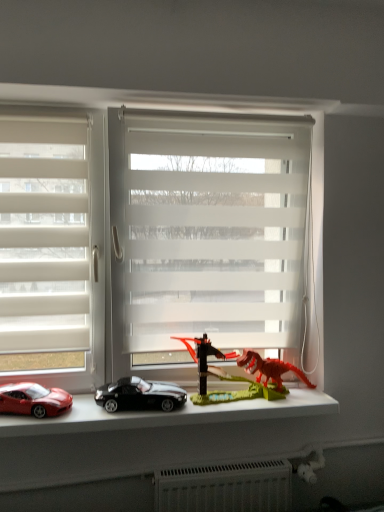
Question: Is white translucent blinds at left, which is counted as the 1th window, starting from the left, oriented towards shiny red car at lower left, which is the first car from left to right?

Choices:
 (A) no
 (B) yes

Answer: (A)

Question: From a real-world perspective, does white translucent blinds at left, which ranks as the second window in right-to-left order, stand above shiny red car at lower left, placed as the 2th car when sorted from right to left?

Choices:
 (A) no
 (B) yes

Answer: (B)

Question: Is the depth of white translucent blinds at left, which ranks as the second window in right-to-left order, less than that of shiny red car at lower left, placed as the 2th car when sorted from right to left?

Choices:
 (A) no
 (B) yes

Answer: (A)

Question: From the image's perspective, is white translucent blinds at left, which is counted as the 1th window, starting from the left, located beneath shiny red car at lower left, placed as the 2th car when sorted from right to left?

Choices:
 (A) yes
 (B) no

Answer: (B)

Question: Is white translucent blinds at left, which ranks as the second window in right-to-left order, to the left or to the right of rubberized red dinosaur at center in the image?

Choices:
 (A) right
 (B) left

Answer: (B)

Question: From a real-world perspective, is white translucent blinds at left, which is counted as the 1th window, starting from the left, positioned above or below rubberized red dinosaur at center?

Choices:
 (A) below
 (B) above

Answer: (B)

Question: Is white translucent blinds at left, which ranks as the second window in right-to-left order, bigger or smaller than rubberized red dinosaur at center?

Choices:
 (A) small
 (B) big

Answer: (A)

Question: Is point (6, 330) closer or farther from the camera than point (200, 371)?

Choices:
 (A) farther
 (B) closer

Answer: (B)

Question: Is rubberized red dinosaur at center inside or outside of white translucent blinds at left, which is counted as the 1th window, starting from the left?

Choices:
 (A) inside
 (B) outside

Answer: (B)

Question: From the image's perspective, is rubberized red dinosaur at center above or below white translucent blinds at left, which is counted as the 1th window, starting from the left?

Choices:
 (A) above
 (B) below

Answer: (B)

Question: Considering the positions of point (223, 395) and point (28, 373), is point (223, 395) closer or farther from the camera than point (28, 373)?

Choices:
 (A) closer
 (B) farther

Answer: (B)

Question: In terms of height, does rubberized red dinosaur at center look taller or shorter compared to white translucent blinds at left, which is counted as the 1th window, starting from the left?

Choices:
 (A) tall
 (B) short

Answer: (B)

Question: Is shiny black car at center, the 2th car from the left, bigger or smaller than rubberized red dinosaur at center?

Choices:
 (A) small
 (B) big

Answer: (A)

Question: Would you say shiny black car at center, placed as the first car when sorted from right to left, is to the left or to the right of rubberized red dinosaur at center in the picture?

Choices:
 (A) right
 (B) left

Answer: (B)